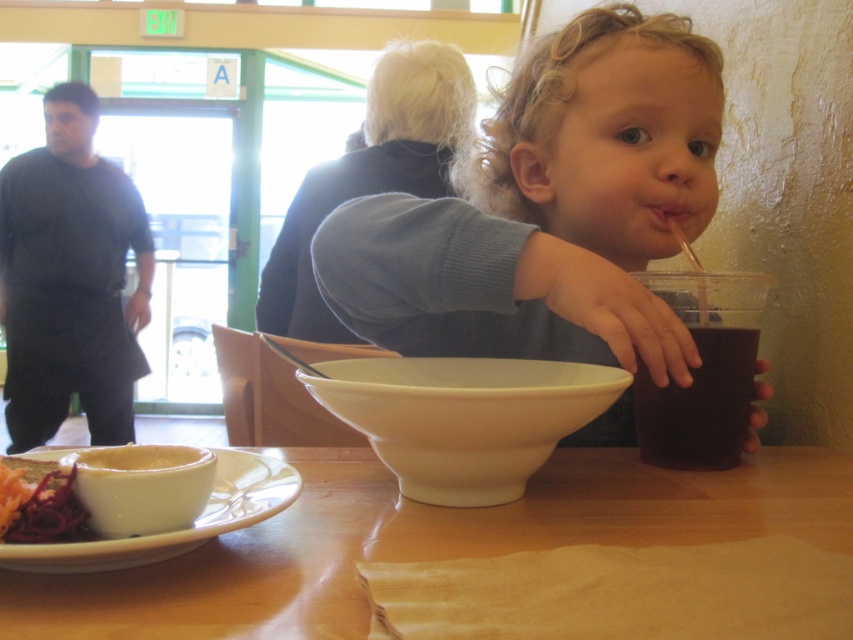
You are a person who is 5 feet tall and want to sit at the wooden table at center. Can you comfortably reach the table?

The wooden table at center is 11.53 inches away from the viewer. Since the distance is relatively short, a person who is 5 feet tall can comfortably reach the table.

You are a server at the restaurant and need to deliver a drink to the customer wearing the black matte shirt at left. The smooth plastic cup at center contains the drink. Can you hand the drink directly to the customer without moving the cup?

The smooth plastic cup at center is to the right of the black matte shirt at left, so you can hand the drink directly to the customer without moving the cup because the cup is already positioned next to the customer.

You are a customer sitting at the wooden table at center. You want to reach for the dark matte cup at right to take a sip. Is the cup above or below your eye level?

The wooden table at center is located below dark matte cup at right, meaning the cup is above your eye level since the table is below it.